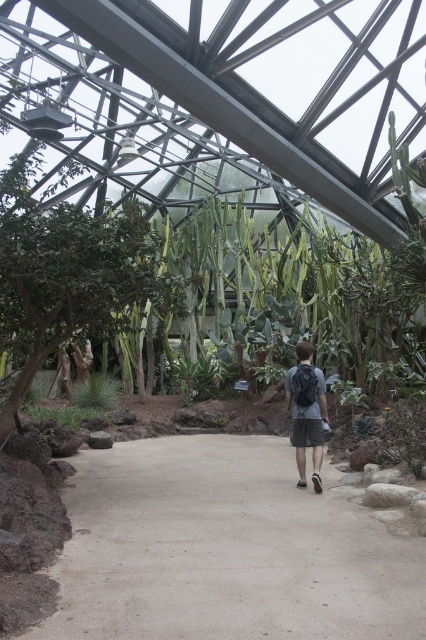
You are a visitor in the greenhouse and want to place your dark gray backpack at center on the ground. However, there is a smooth concrete path at center in the way. Where should you place your backpack?

The smooth concrete path at center is on the left side of the dark gray backpack at center, so you should place the backpack to the right of the path.

You are a gardener who needs to place a dark gray backpack at center on the smooth concrete path at center. Is there enough space on the path to place the backpack without it hanging off the edge?

The smooth concrete path at center is smaller than the dark gray backpack at center, so placing the backpack on the path would cause it to hang off the edges since the path is not large enough to accommodate the backpack.